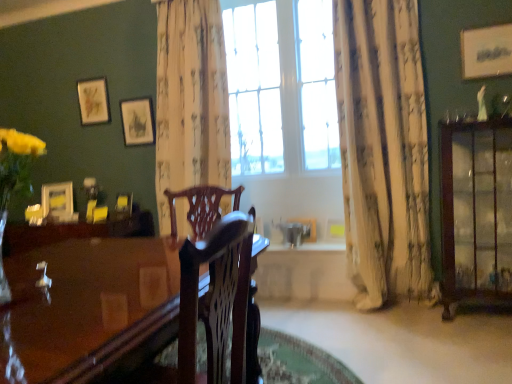
Question: Is matte yellow picture frame at left, which is the 5th picture frame from front to back, thinner than brown wood cabinet at right?

Choices:
 (A) yes
 (B) no

Answer: (A)

Question: Does matte yellow picture frame at left, which is the third picture frame in bottom-to-top order, touch brown wood cabinet at right?

Choices:
 (A) no
 (B) yes

Answer: (A)

Question: Is matte yellow picture frame at left, the 4th picture frame viewed from the top, bigger than brown wood cabinet at right?

Choices:
 (A) yes
 (B) no

Answer: (B)

Question: Does matte yellow picture frame at left, which is the sixth picture frame from right to left, have a lesser height compared to brown wood cabinet at right?

Choices:
 (A) no
 (B) yes

Answer: (B)

Question: From a real-world perspective, is matte yellow picture frame at left, which is the sixth picture frame from right to left, below brown wood cabinet at right?

Choices:
 (A) no
 (B) yes

Answer: (A)

Question: Is matte yellow picture frame at left, which is the third picture frame in bottom-to-top order, facing towards brown wood cabinet at right?

Choices:
 (A) no
 (B) yes

Answer: (A)

Question: From a real-world perspective, is matte gold picture frame at upper left, which is the 2th picture frame from left to right, beneath white textured curtain at right, which appears as the second curtain when viewed from the left?

Choices:
 (A) no
 (B) yes

Answer: (A)

Question: Is matte gold picture frame at upper left, which is the 2th picture frame from left to right, positioned behind white textured curtain at right, which appears as the second curtain when viewed from the left?

Choices:
 (A) yes
 (B) no

Answer: (A)

Question: Can you see matte gold picture frame at upper left, which ranks as the 2th picture frame in top-to-bottom order, touching white textured curtain at right, which appears as the 1th curtain when viewed from the right?

Choices:
 (A) no
 (B) yes

Answer: (A)

Question: Does matte gold picture frame at upper left, which appears as the fifth picture frame when ordered from the bottom, have a greater height compared to white textured curtain at right, which appears as the second curtain when viewed from the left?

Choices:
 (A) no
 (B) yes

Answer: (A)

Question: From the image's perspective, is matte gold picture frame at upper left, which ranks as the 2th picture frame in top-to-bottom order, on white textured curtain at right, which appears as the 1th curtain when viewed from the right?

Choices:
 (A) no
 (B) yes

Answer: (B)

Question: Does matte gold picture frame at upper left, which appears as the fifth picture frame when ordered from the bottom, have a lesser width compared to white textured curtain at right, which appears as the 1th curtain when viewed from the right?

Choices:
 (A) no
 (B) yes

Answer: (B)

Question: Does wooden picture frame at center, the first picture frame ordered from the bottom, have a lesser width compared to glossy wood table at center?

Choices:
 (A) yes
 (B) no

Answer: (A)